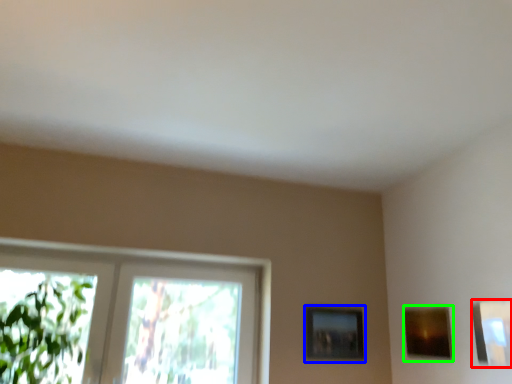
Question: Which object is positioned farthest from picture frame (highlighted by a red box)? Select from picture frame (highlighted by a blue box) and picture frame (highlighted by a green box).

Choices:
 (A) picture frame
 (B) picture frame

Answer: (A)